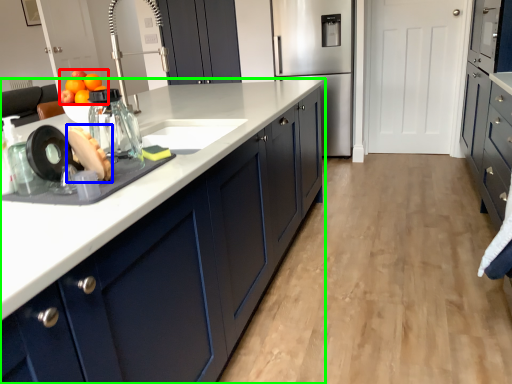
Question: Considering the real-world distances, which object is closest to fruit (highlighted by a red box)? food (highlighted by a blue box) or cabinetry (highlighted by a green box).

Choices:
 (A) food
 (B) cabinetry

Answer: (B)